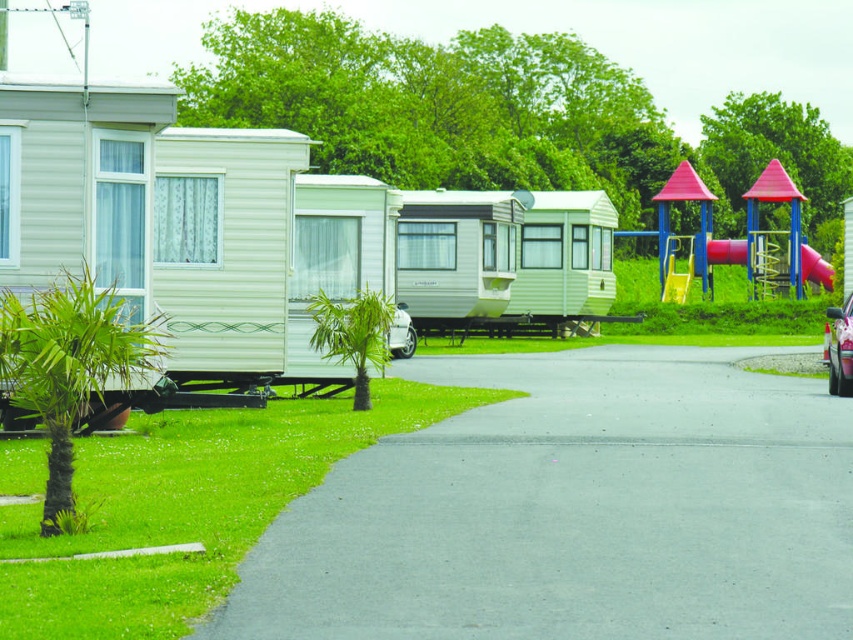
You are standing at the entrance of the mobile home park and want to reach the playground. According to the image, where is the asphalt at center located relative to the point marked by coordinates point (573, 509)?

The point (573, 509) marks the asphalt at center, so it is exactly at that location.

You are standing at the entrance of the mobile home park and want to walk to the playground. There are two points marked on your map, point 1 at coordinates point (440, 483) and point 2 at coordinates point (844, 344). Which point is closer to you as you start walking towards the playground?

Point (440, 483) is closer to the viewer than point (844, 344), so point 1 is closer to you as you start walking towards the playground.